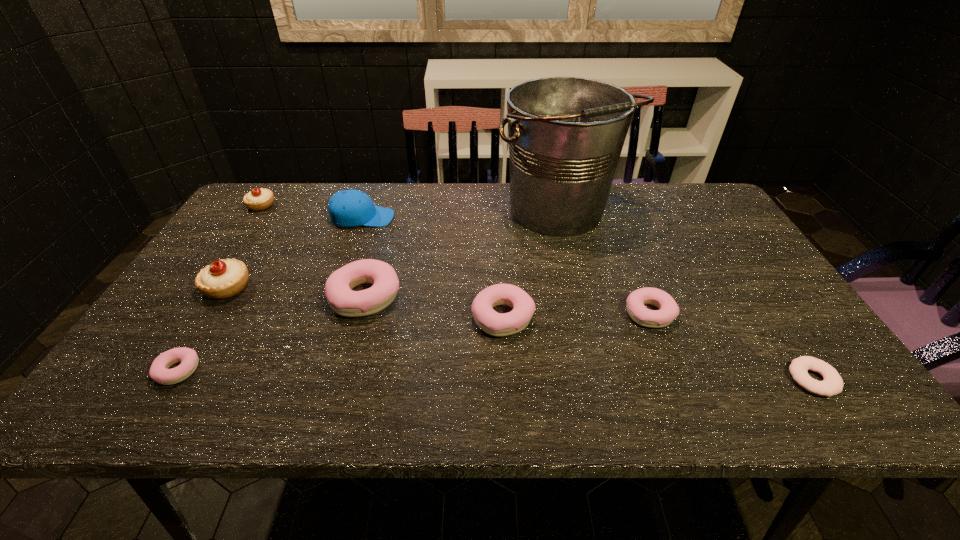
Find the location of a particular element. The height and width of the screenshot is (540, 960). object present at the right edge is located at coordinates (832, 384).

Where is `object situated at the far left corner`? object situated at the far left corner is located at coordinates (258, 199).

Where is `object that is at the near left corner`? object that is at the near left corner is located at coordinates tap(159, 372).

This screenshot has width=960, height=540. I want to click on object that is at the near right corner, so click(x=832, y=384).

Locate an element on the screen. free space at the far edge of the desktop is located at coordinates (412, 203).

Identify the location of free space at the near edge. tap(365, 400).

In the image, there is a desktop. In order to click on vacant space at the right edge in this screenshot , I will do `click(741, 288)`.

Where is `free space at the near left corner of the desktop`? The height and width of the screenshot is (540, 960). free space at the near left corner of the desktop is located at coordinates (114, 399).

In the image, there is a desktop. Find the location of `free space at the far right corner`. free space at the far right corner is located at coordinates (691, 195).

Identify the location of empty location between the bigger beige pastry and the farthest pastry. The height and width of the screenshot is (540, 960). (245, 246).